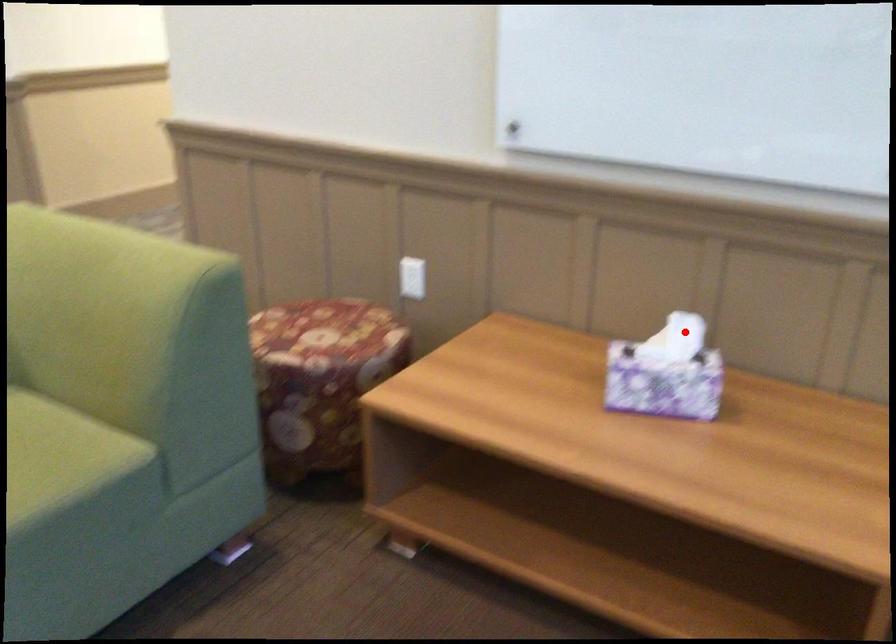
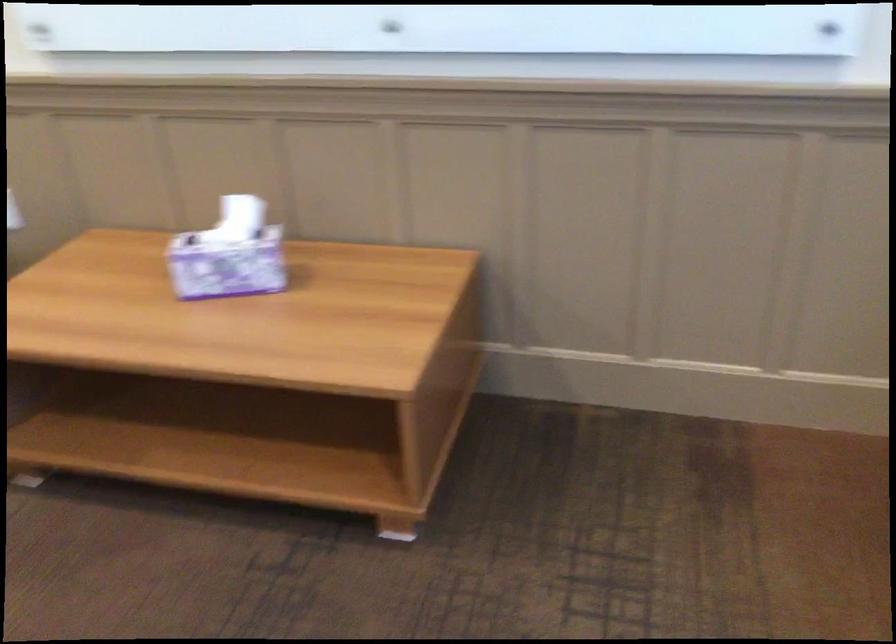
The point at the highlighted location is marked in the first image. Where is the corresponding point in the second image?

(239, 218)